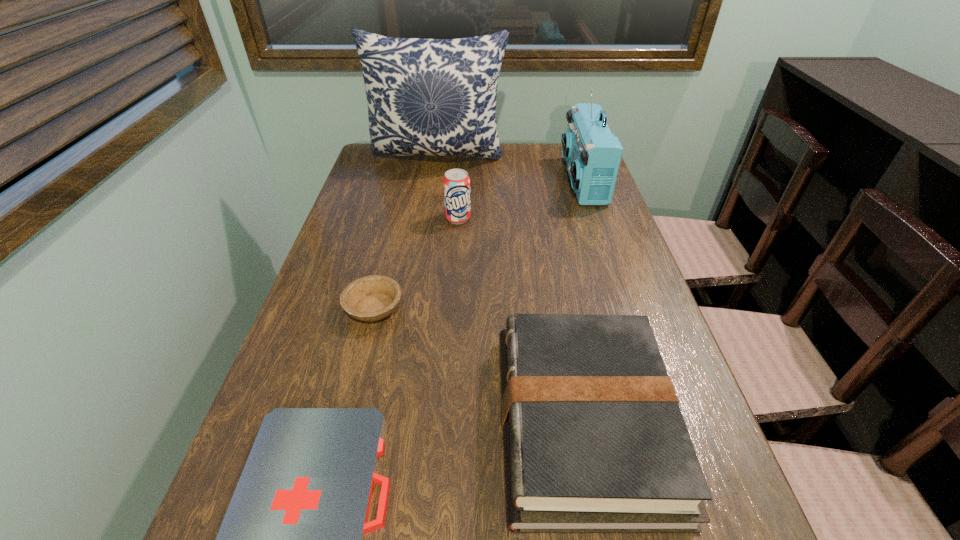
Image resolution: width=960 pixels, height=540 pixels. In order to click on the tallest object in this screenshot , I will do `click(433, 97)`.

You are a GUI agent. You are given a task and a screenshot of the screen. Output one action in this format:
    pyautogui.click(x=<x>, y=<y>)
    Task: Click on the second tallest object
    The width and height of the screenshot is (960, 540).
    Given the screenshot: What is the action you would take?
    pyautogui.click(x=592, y=153)

I want to click on soda can, so click(456, 183).

Find the location of a particular element. the third farthest object is located at coordinates point(456,183).

This screenshot has width=960, height=540. I want to click on the third shortest object, so click(x=594, y=439).

Find the location of a particular element. Image resolution: width=960 pixels, height=540 pixels. the fifth tallest object is located at coordinates (369, 298).

Where is `bowl`? bowl is located at coordinates (369, 298).

At what (x,y) coordinates should I click in order to perform the action: click on vacant point located on the front surface of the tallest object. Please return your answer as a coordinate pair (x, y). This screenshot has height=540, width=960. Looking at the image, I should click on (428, 227).

In order to click on vacant position located on the front-facing side of the radio receiver in this screenshot , I will do `click(471, 181)`.

Find the location of a particular element. free location located on the front-facing side of the radio receiver is located at coordinates (436, 181).